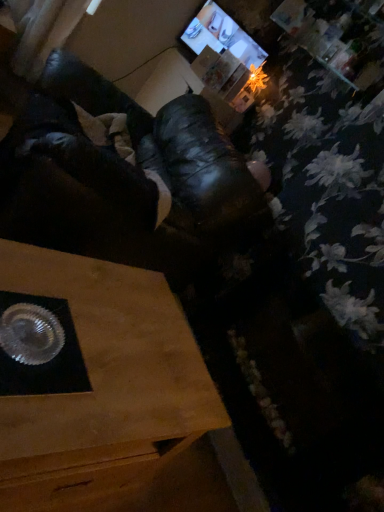
Based on the photo, in order to face wooden table at lower left, should I rotate leftwards or rightwards?

Rotate left and turn 16.423 degrees.

The image size is (384, 512). I want to click on shiny metallic tray at lower left, so click(x=120, y=172).

Between wooden table at lower left and shiny metallic tray at lower left, which one has smaller width?

With smaller width is wooden table at lower left.

Is wooden table at lower left oriented away from shiny metallic tray at lower left?

That's not correct — wooden table at lower left is not looking away from shiny metallic tray at lower left.

From the picture: Is wooden table at lower left positioned before shiny metallic tray at lower left?

Yes, it is in front of shiny metallic tray at lower left.

Where is `squat located behind the wooden table at lower left`? This screenshot has width=384, height=512. squat located behind the wooden table at lower left is located at coordinates (120, 172).

From a real-world perspective, is wooden table at lower left positioned above or below matte black monitor at upper center?

Clearly, from a real-world perspective, wooden table at lower left is below matte black monitor at upper center.

Who is taller, wooden table at lower left or matte black monitor at upper center?

wooden table at lower left is taller.

From the image's perspective, which is below, wooden table at lower left or matte black monitor at upper center?

wooden table at lower left appears lower in the image.

Considering the points (32, 447) and (243, 55), which point is behind, point (32, 447) or point (243, 55)?

The point (243, 55) is farther.

Is matte black monitor at upper center shorter than wooden table at lower left?

Yes, matte black monitor at upper center is shorter than wooden table at lower left.

From a real-world perspective, between matte black monitor at upper center and wooden table at lower left, who is vertically lower?

In real-world perspective, wooden table at lower left is lower.

Is matte black monitor at upper center looking in the opposite direction of wooden table at lower left?

No.

Consider the image. Is shiny metallic tray at lower left looking in the opposite direction of matte black monitor at upper center?

No.

Is shiny metallic tray at lower left further to camera compared to matte black monitor at upper center?

No, shiny metallic tray at lower left is closer to the viewer.

From the image's perspective, between shiny metallic tray at lower left and matte black monitor at upper center, who is located below?

shiny metallic tray at lower left is shown below in the image.

Looking at this image, which object is wider, shiny metallic tray at lower left or matte black monitor at upper center?

shiny metallic tray at lower left.

Considering their positions, is matte black monitor at upper center located in front of or behind shiny metallic tray at lower left?

matte black monitor at upper center is positioned farther from the viewer than shiny metallic tray at lower left.

Which is behind, point (250, 41) or point (85, 160)?

The point (250, 41) is more distant.

Between matte black monitor at upper center and shiny metallic tray at lower left, which one appears on the left side from the viewer's perspective?

shiny metallic tray at lower left.

How much distance is there between matte black monitor at upper center and shiny metallic tray at lower left?

The distance of matte black monitor at upper center from shiny metallic tray at lower left is 1.08 meters.

Where is `table below the shiny metallic tray at lower left (from the image's perspective)`? table below the shiny metallic tray at lower left (from the image's perspective) is located at coordinates (112, 399).

Is shiny metallic tray at lower left next to wooden table at lower left and touching it?

shiny metallic tray at lower left and wooden table at lower left are clearly separated.

Looking at this image, is shiny metallic tray at lower left positioned with its back to wooden table at lower left?

No, shiny metallic tray at lower left is not facing away from wooden table at lower left.

How far apart are shiny metallic tray at lower left and wooden table at lower left?

The distance of shiny metallic tray at lower left from wooden table at lower left is 73.31 centimeters.

Locate an element on the screen. table below the shiny metallic tray at lower left (from a real-world perspective) is located at coordinates (112, 399).

You are a GUI agent. You are given a task and a screenshot of the screen. Output one action in this format:
    pyautogui.click(x=<x>, y=<y>)
    Task: Click on the table located on the left of matte black monitor at upper center
    The height and width of the screenshot is (512, 384).
    Given the screenshot: What is the action you would take?
    112,399

When comparing their distances from matte black monitor at upper center, does wooden table at lower left or shiny metallic tray at lower left seem further?

Among the two, wooden table at lower left is located further to matte black monitor at upper center.

Estimate the real-world distances between objects in this image. Which object is further from wooden table at lower left, matte black monitor at upper center or shiny metallic tray at lower left?

Among the two, matte black monitor at upper center is located further to wooden table at lower left.

Looking at the image, which one is located closer to matte black monitor at upper center, shiny metallic tray at lower left or wooden table at lower left?

shiny metallic tray at lower left lies closer to matte black monitor at upper center than the other object.

Considering their positions, is matte black monitor at upper center positioned closer to shiny metallic tray at lower left than wooden table at lower left?

wooden table at lower left lies closer to shiny metallic tray at lower left than the other object.

Considering their positions, is shiny metallic tray at lower left positioned further to wooden table at lower left than matte black monitor at upper center?

matte black monitor at upper center is further to wooden table at lower left.

Based on their spatial positions, is wooden table at lower left or matte black monitor at upper center further from shiny metallic tray at lower left?

Among the two, matte black monitor at upper center is located further to shiny metallic tray at lower left.

The height and width of the screenshot is (512, 384). I want to click on squat between wooden table at lower left and matte black monitor at upper center along the z-axis, so click(120, 172).